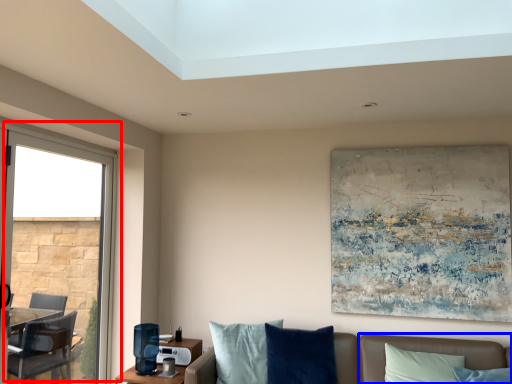
Question: Which object appears closest to the camera in this image, window (highlighted by a red box) or couch (highlighted by a blue box)?

Choices:
 (A) window
 (B) couch

Answer: (A)